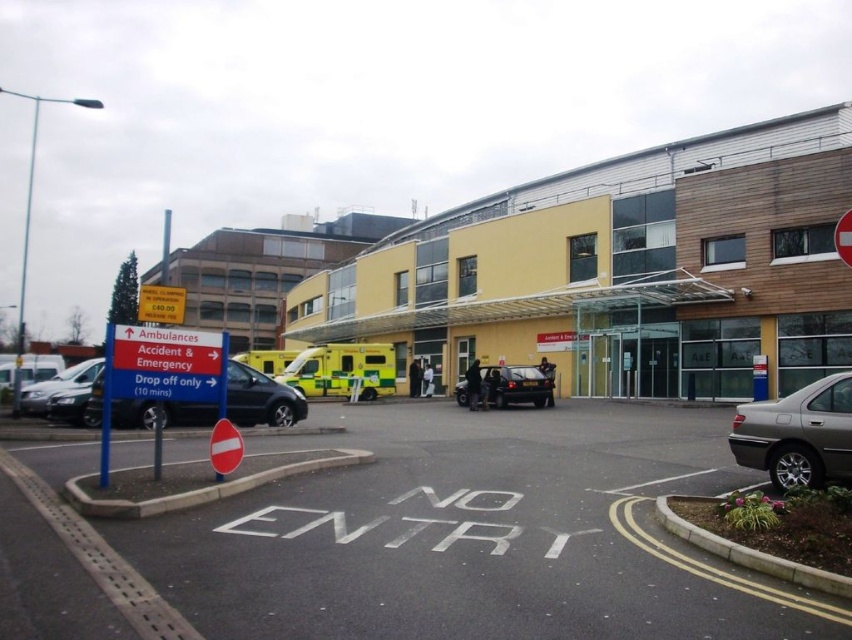
You are a delivery driver who needs to park your vehicle in the black asphalt parking lot at center. According to the hospital map, the coordinates of the parking lot are at point 0.836, 0.558. Is this parking lot located towards the north or south side of the hospital building?

The black asphalt parking lot at center is located at coordinates (475, 534). Since the hospital building is depicted in the scene with the parking lot at the center, the coordinates indicate it is centrally positioned rather than north or south.

From the picture: You are a delivery person who needs to park your 1.8 meters tall delivery van. You see a black glossy car at center and a silver metallic van at left in the hospital parking area. Which vehicle is shorter and can fit under a 2.0 meters height restriction sign?

The black glossy car at center has a lesser height compared to the silver metallic van at left, so it can fit under the 2.0 meters height restriction sign.

You are a hospital staff member driving a 2.5 meters long cart. You need to move from the black asphalt parking lot at center to the silver metallic sedan at lower right. Is there enough space for your cart to maneuver between them?

The distance between the black asphalt parking lot at center and the silver metallic sedan at lower right is 5.69 meters. Since your cart is 2.5 meters long, there is sufficient space to maneuver between them as 5.69 meters is greater than 2.5 meters.